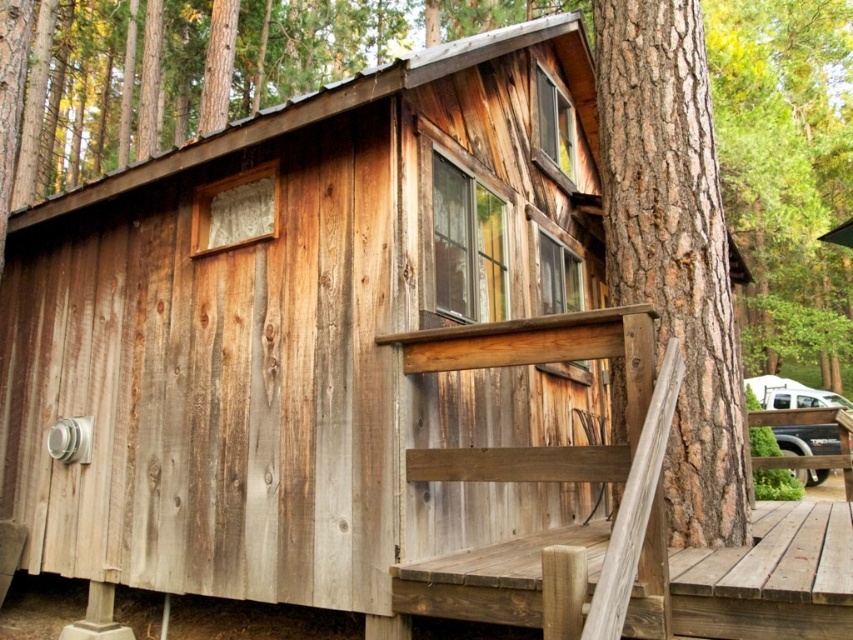
Based on the photo, you are standing at the base of the rough bark tree trunk at center and want to reach the weathered wood deck at lower right. Which direction should you move to get there?

The weathered wood deck at lower right is to the right of the rough bark tree trunk at center, so you should move to the right to reach it.

Looking at this image, you are standing at the base of the rough bark tree trunk at center, which is part of a large tree growing next to a rustic wooden cabin. The cabin has a small wooden staircase leading to its entrance. If you want to reach the cabin entrance, which direction should you move relative to the tree trunk?

You should move away from the rough bark tree trunk at center towards the cabin entrance, as the tree trunk is positioned between you and the cabin. Since the trunk is 13.43 feet from the camera, moving away from it would bring you closer to the cabin entrance.

You are standing at the edge of the forest near the weathered wood deck at lower right and want to walk towards the cabin entrance. The rough bark tree trunk at center is blocking your path. Can you walk around the tree trunk to reach the cabin entrance?

The rough bark tree trunk at center has a lesser width compared to the weathered wood deck at lower right, so yes, you can walk around the tree trunk to reach the cabin entrance since it is narrower than the deck, providing enough space to maneuver around it.